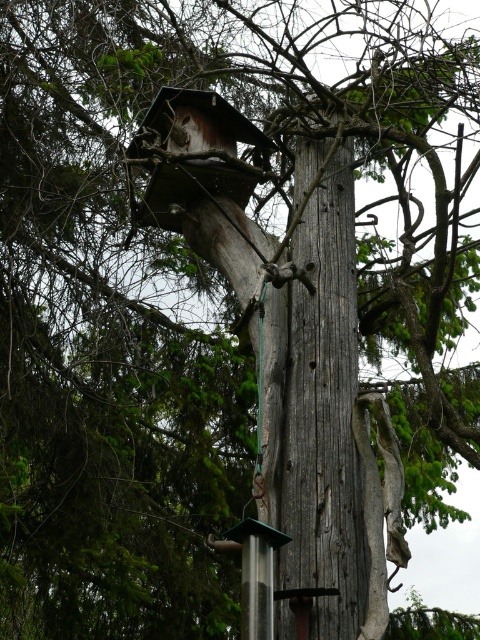
You are a bird looking for a place to rest. You see the weathered wood tree trunk at center and the wooden birdhouse at upper center. Which one is bigger and would provide more space?

The weathered wood tree trunk at center is larger in size compared to the wooden birdhouse at upper center, so it would provide more space for resting.

You are a small bird looking for a nesting spot. You see the weathered wood tree trunk at center and the wooden birdhouse at upper center. Which one is taller?

The weathered wood tree trunk at center is taller than the wooden birdhouse at upper center.

Based on the scene description, where is the weathered wood tree trunk at center located in the image?

The weathered wood tree trunk at center is located at point 2D coordinates of (328, 410).